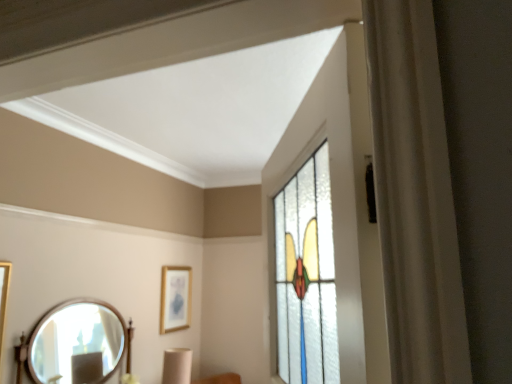
Question: From the image's perspective, is gold-framed picture at center located above or below wooden framed mirror at lower left?

Choices:
 (A) below
 (B) above

Answer: (B)

Question: Considering the positions of gold-framed picture at center and wooden framed mirror at lower left in the image, is gold-framed picture at center taller or shorter than wooden framed mirror at lower left?

Choices:
 (A) tall
 (B) short

Answer: (B)

Question: From a real-world perspective, is gold-framed picture at center physically located above or below wooden framed mirror at lower left?

Choices:
 (A) above
 (B) below

Answer: (A)

Question: Would you say wooden framed mirror at lower left is to the left or to the right of gold-framed picture at center in the picture?

Choices:
 (A) left
 (B) right

Answer: (A)

Question: From the image's perspective, is wooden framed mirror at lower left above or below gold-framed picture at center?

Choices:
 (A) below
 (B) above

Answer: (A)

Question: Would you say wooden framed mirror at lower left is inside or outside gold-framed picture at center?

Choices:
 (A) outside
 (B) inside

Answer: (A)

Question: Does point (82, 349) appear closer or farther from the camera than point (180, 279)?

Choices:
 (A) closer
 (B) farther

Answer: (A)